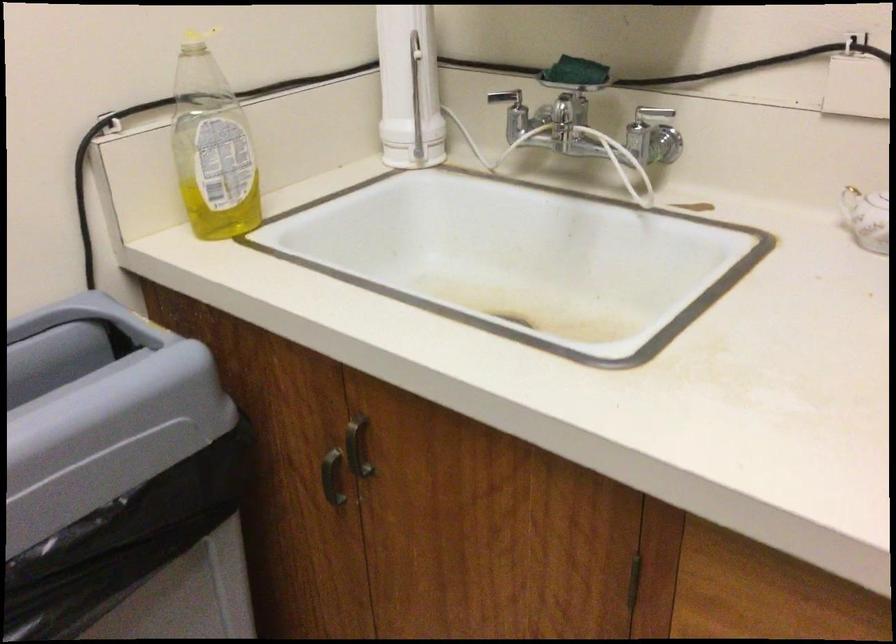
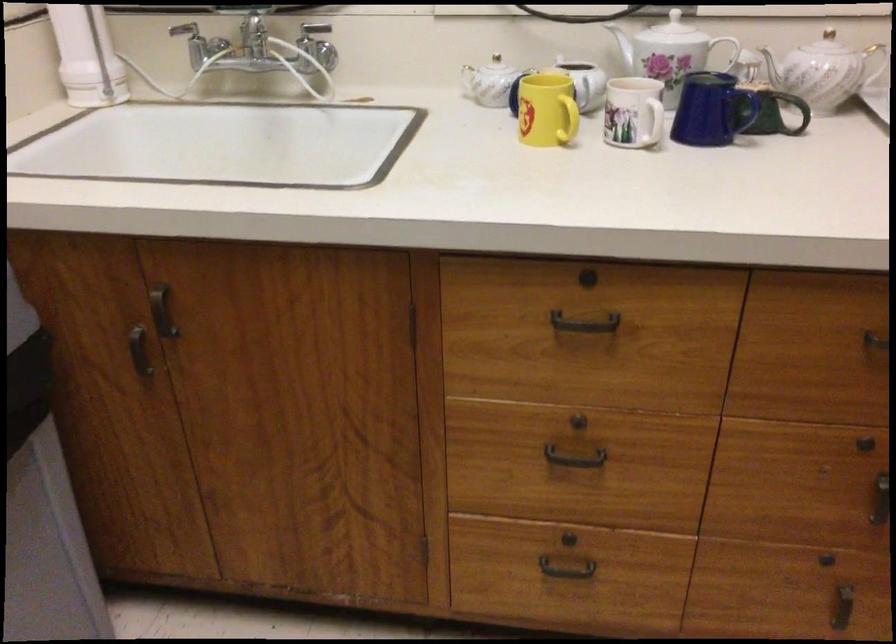
Question: How did the camera likely rotate?

Choices:
 (A) Left
 (B) Right
 (C) Up
 (D) Down

Answer: (B)